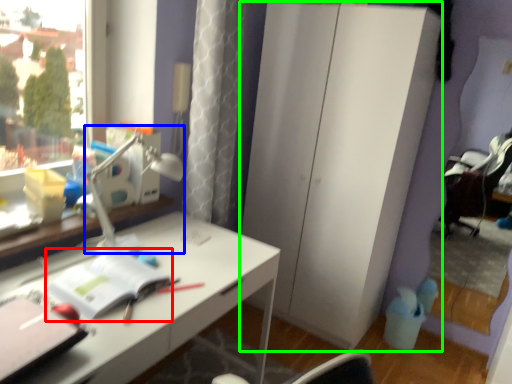
Question: Which is nearer to the notebook (highlighted by a red box)? table lamp (highlighted by a blue box) or dresser (highlighted by a green box).

Choices:
 (A) table lamp
 (B) dresser

Answer: (A)